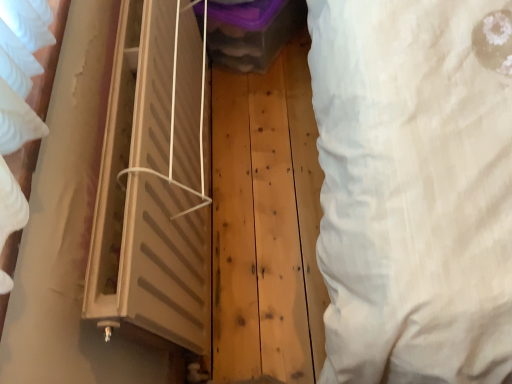
This screenshot has height=384, width=512. Find the location of `free space above beige plastic window at center (from a real-world perspective)`. free space above beige plastic window at center (from a real-world perspective) is located at coordinates (116, 114).